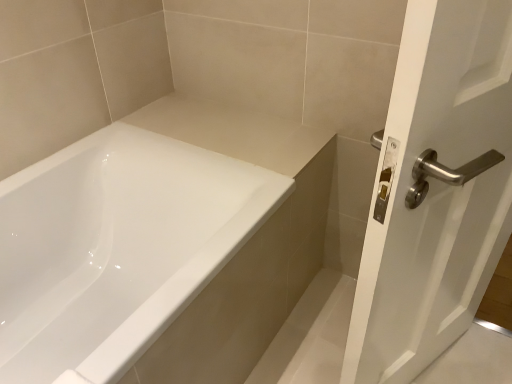
Describe the element at coordinates (435, 191) in the screenshot. I see `white glossy door handle at right` at that location.

Identify the location of white glossy door handle at right. This screenshot has height=384, width=512. (435, 191).

The width and height of the screenshot is (512, 384). I want to click on white glossy door handle at right, so click(x=435, y=191).